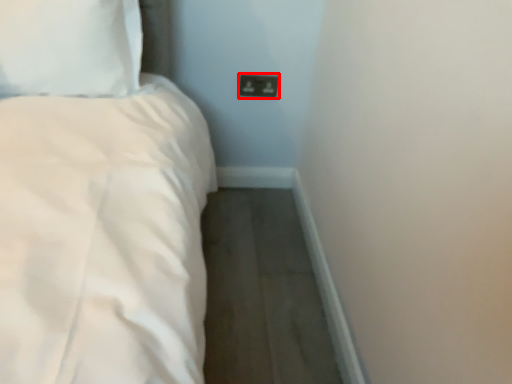
Question: Considering the relative positions of socket (annotated by the red box) and pillow in the image provided, where is socket (annotated by the red box) located with respect to the staircase?

Choices:
 (A) left
 (B) right

Answer: (B)